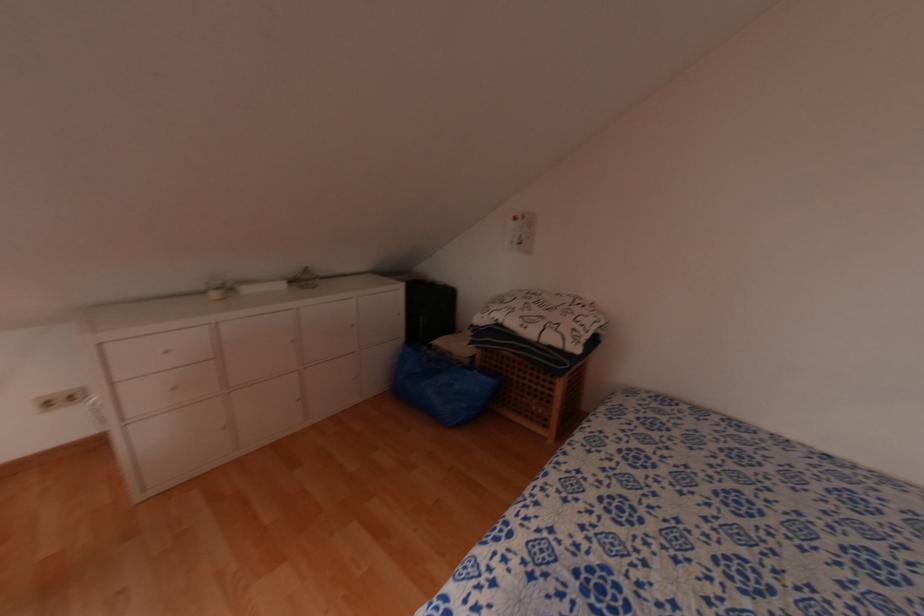
You are a GUI agent. You are given a task and a screenshot of the screen. Output one action in this format:
    pyautogui.click(x=<x>, y=<y>)
    Task: Click on the wicker laundry basket
    
    Given the screenshot: What is the action you would take?
    (x=533, y=392)